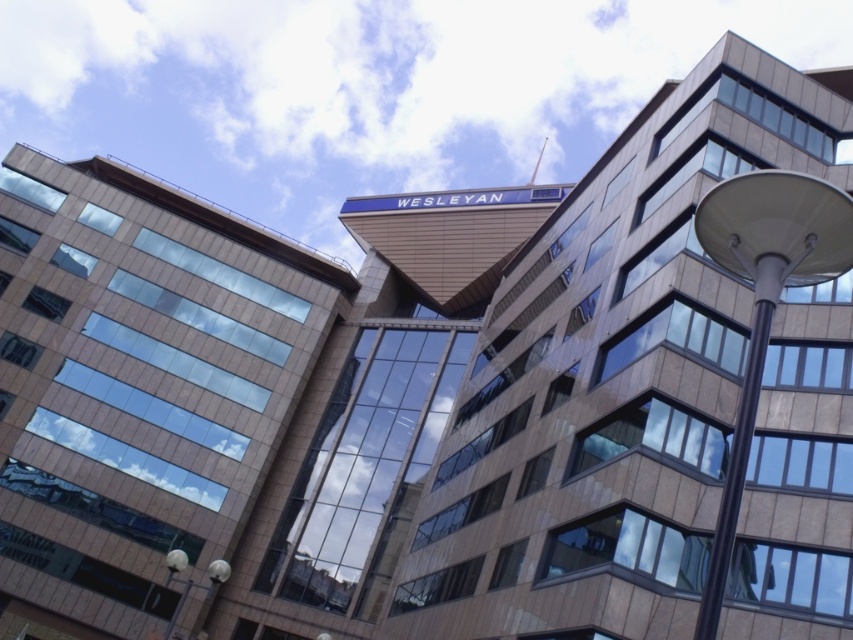
You are standing at the base of the building and want to locate the brown stone building at upper center. According to the coordinate system where the bottom left corner is the origin, what are its coordinates?

The brown stone building at upper center is located at coordinates point (x=612, y=378).

You are a city planner analyzing the building facade. Which object, the brown stone building at upper center or the white glossy streetlight at right, has a greater width?

The brown stone building at upper center has a greater width than the white glossy streetlight at right according to the description.

You are a photographer planning to capture the brown stone building at upper center and the white glossy streetlight at right in a single shot. Considering their sizes, which object should you frame first to ensure both are visible in the photo?

The brown stone building at upper center is larger in size than the white glossy streetlight at right, so you should frame the brown stone building at upper center first to accommodate its size and ensure both objects fit in the shot.